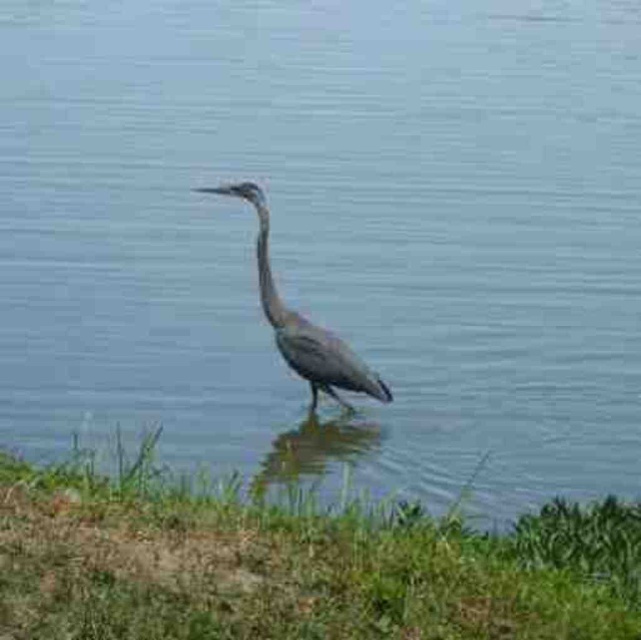
You are a photographer trying to capture the gray matte bird at center while standing on the green grass at lower left. Can you safely walk towards the bird without getting your feet wet?

The distance between the green grass at lower left and gray matte bird at center is 2.60 meters. Since the bird is standing in shallow water, you would need to walk through the water to reach it, so your feet will get wet.

You are a photographer aiming to capture the gray matte bird at center and the green grass at lower left in the same frame. Based on their positions, which object is closer to the left edge of the photo?

The gray matte bird at center is closer to the left edge of the photo because the green grass at lower left is to the right of it.